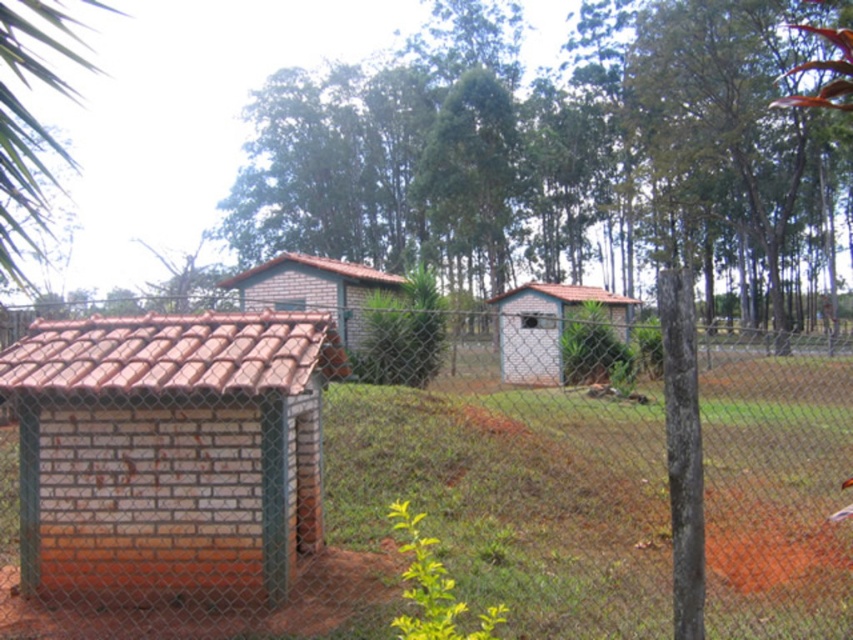
Does chain link fence at center have a lesser width compared to brown brick hut at center?

No.

Which of these two, chain link fence at center or brown brick hut at center, stands taller?

chain link fence at center is taller.

I want to click on chain link fence at center, so click(x=415, y=480).

Which is behind, point (631, 472) or point (618, 337)?

The point (618, 337) is behind.

Between chain link fence at center and white brick hut at center, which one has less height?

Standing shorter between the two is chain link fence at center.

At what (x,y) coordinates should I click in order to perform the action: click on chain link fence at center. Please return your answer as a coordinate pair (x, y). The image size is (853, 640). Looking at the image, I should click on (415, 480).

This screenshot has width=853, height=640. Find the location of `chain link fence at center`. chain link fence at center is located at coordinates (415, 480).

Which of these two, brick/tile hut at left or white brick hut at center, stands shorter?

With less height is brick/tile hut at left.

Is brick/tile hut at left below white brick hut at center?

Yes, brick/tile hut at left is below white brick hut at center.

Image resolution: width=853 pixels, height=640 pixels. Identify the location of brick/tile hut at left. (169, 449).